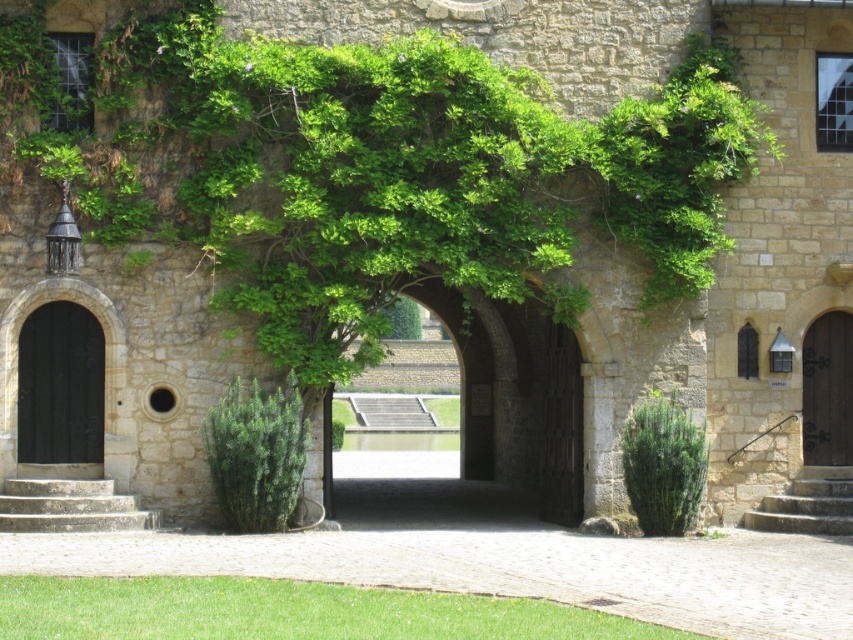
Is point (88, 637) less distant than point (821, 381)?

Yes, point (88, 637) is in front of point (821, 381).

Who is more distant from viewer, (138, 582) or (849, 390)?

The point (849, 390) is more distant.

The width and height of the screenshot is (853, 640). Identify the location of green leafy plant at lower center. (287, 611).

Where is `green leafy plant at lower center`? This screenshot has height=640, width=853. green leafy plant at lower center is located at coordinates (287, 611).

Is matte black door at left bigger than green leafy bush at center?

Incorrect, matte black door at left is not larger than green leafy bush at center.

Is point (38, 320) closer to viewer compared to point (670, 477)?

That is False.

Identify the location of matte black door at left. (61, 385).

Is point (50, 524) more distant than point (827, 488)?

No, (50, 524) is in front of (827, 488).

Is stone steps at lower left to the right of stone stairs at lower right from the viewer's perspective?

No, stone steps at lower left is not to the right of stone stairs at lower right.

I want to click on stone steps at lower left, so click(70, 506).